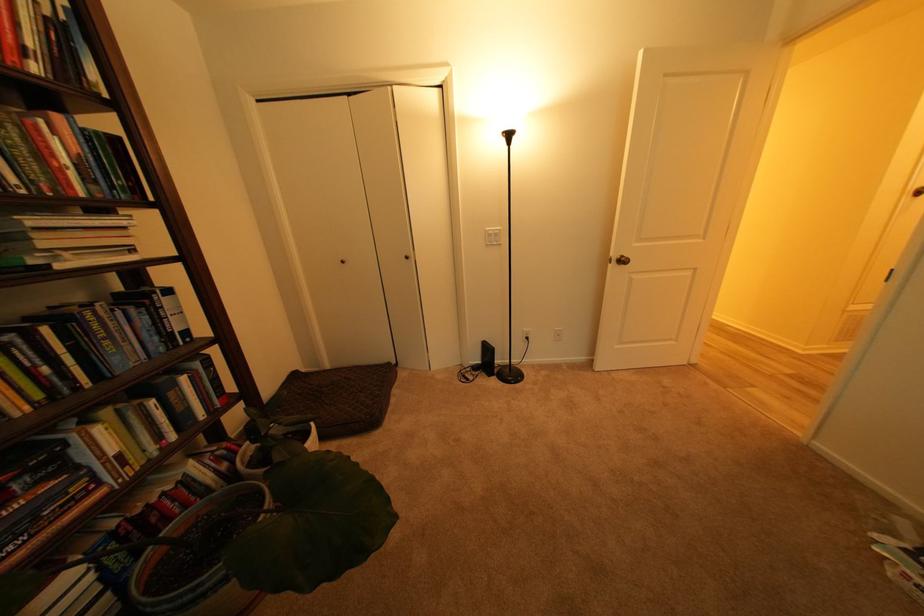
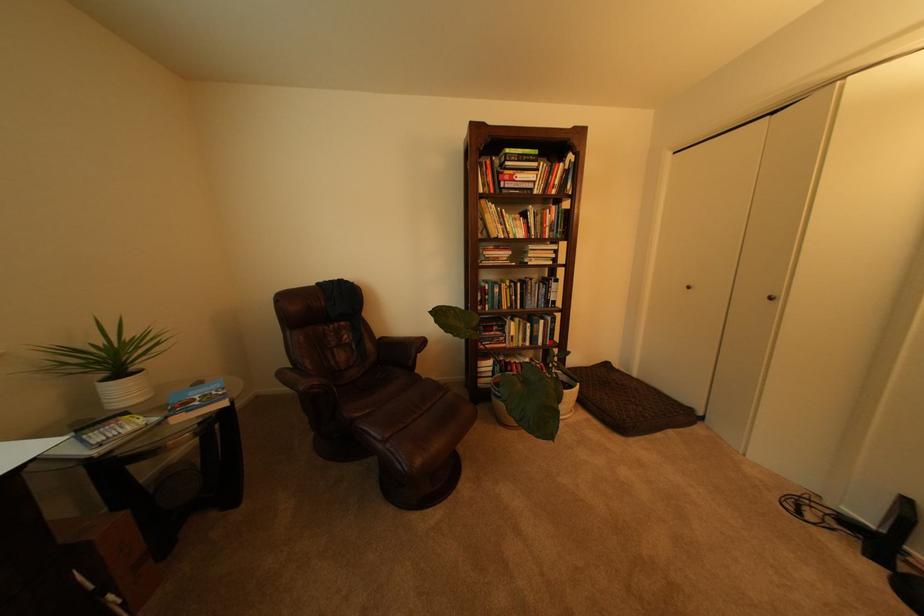
In the second image, find the point that corresponds to point (318, 447) in the first image.

(576, 392)